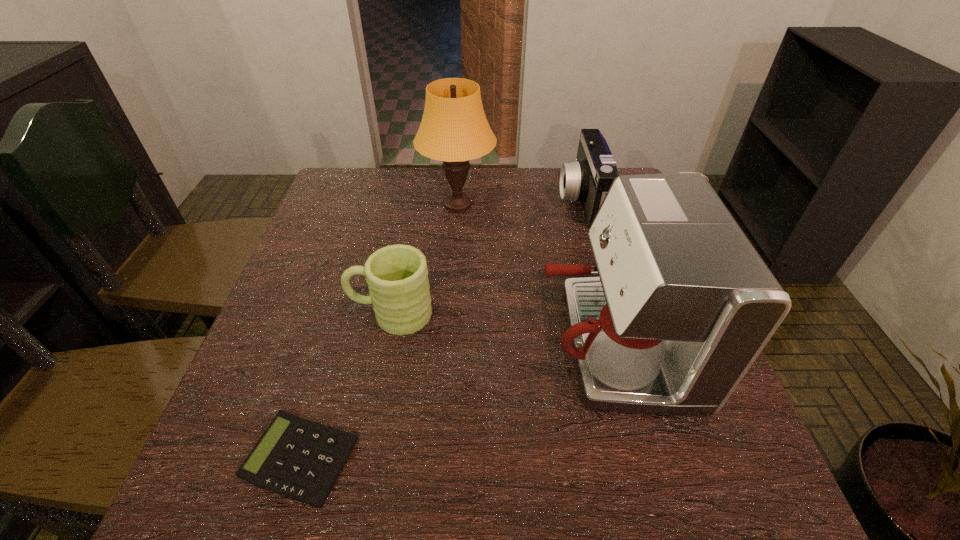
The width and height of the screenshot is (960, 540). I want to click on lampshade, so click(454, 129).

Locate an element on the screen. The width and height of the screenshot is (960, 540). coffee maker is located at coordinates (684, 304).

The width and height of the screenshot is (960, 540). I want to click on camcorder, so click(588, 179).

In order to click on mug in this screenshot , I will do `click(397, 275)`.

You are a GUI agent. You are given a task and a screenshot of the screen. Output one action in this format:
    pyautogui.click(x=<x>, y=<y>)
    Task: Click on the shortest object
    This screenshot has width=960, height=540.
    Given the screenshot: What is the action you would take?
    pyautogui.click(x=298, y=458)

Locate an element on the screen. This screenshot has width=960, height=540. free space located on the front of the lampshade is located at coordinates (451, 308).

The height and width of the screenshot is (540, 960). What are the coordinates of `vacant space located 0.360m on the front of the coffee maker near the spout` in the screenshot? It's located at (361, 342).

Where is `free space located on the front of the coffee maker near the spout`? This screenshot has height=540, width=960. free space located on the front of the coffee maker near the spout is located at coordinates (486, 342).

This screenshot has width=960, height=540. Identify the location of vacant space positioned 0.320m on the front of the coffee maker near the spout. (381, 342).

Where is `vacant space located on the lens of the camcorder`? This screenshot has height=540, width=960. vacant space located on the lens of the camcorder is located at coordinates (432, 201).